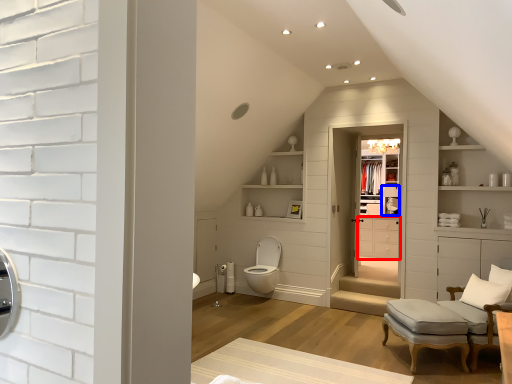
Question: Among these objects, which one is nearest to the camera, cabinetry (highlighted by a red box) or lamp (highlighted by a blue box)?

Choices:
 (A) cabinetry
 (B) lamp

Answer: (A)